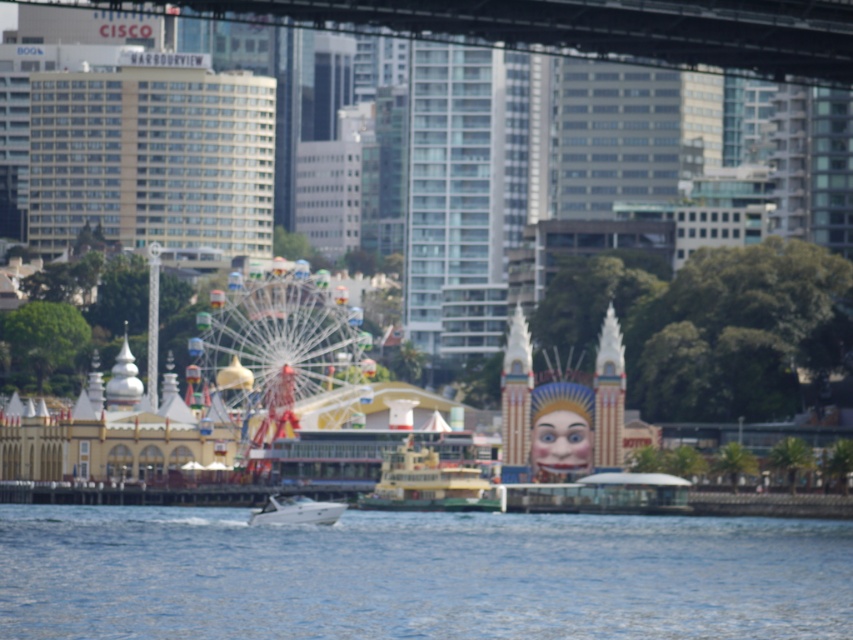
Who is positioned more to the right, blue water at lower center or multicolored metallic ferris wheel at center?

blue water at lower center

Is blue water at lower center to the right of multicolored metallic ferris wheel at center from the viewer's perspective?

Indeed, blue water at lower center is positioned on the right side of multicolored metallic ferris wheel at center.

Is point (198, 561) closer to viewer compared to point (337, 285)?

Yes, point (198, 561) is closer to viewer.

The height and width of the screenshot is (640, 853). Identify the location of blue water at lower center. (418, 573).

Between point (599, 22) and point (422, 458), which one is positioned behind?

Point (599, 22)

Based on the photo, does dark gray concrete bridge at upper center appear under yellow matte ferry at center?

Actually, dark gray concrete bridge at upper center is above yellow matte ferry at center.

Measure the distance between dark gray concrete bridge at upper center and camera.

The distance of dark gray concrete bridge at upper center from camera is 1385.26 feet.

In order to click on dark gray concrete bridge at upper center in this screenshot , I will do `click(604, 28)`.

Is dark gray concrete bridge at upper center above white glossy boat at center?

Yes.

Is dark gray concrete bridge at upper center shorter than white glossy boat at center?

No, dark gray concrete bridge at upper center is not shorter than white glossy boat at center.

Which is behind, point (781, 49) or point (274, 497)?

The point (781, 49) is more distant.

Where is `dark gray concrete bridge at upper center`? The image size is (853, 640). dark gray concrete bridge at upper center is located at coordinates (604, 28).